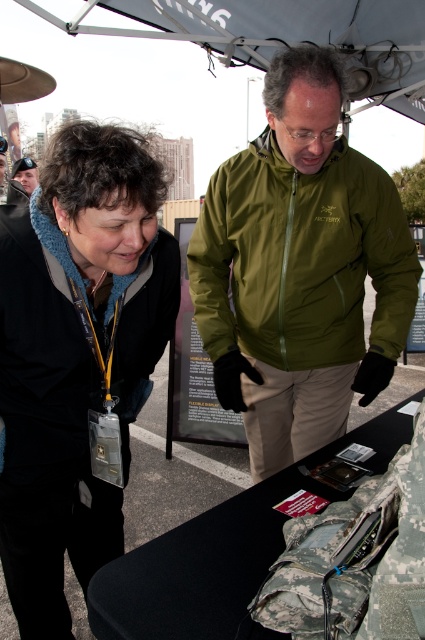
Is the position of black fleece jacket at upper left less distant than that of matte black helmet at upper left?

Yes, it is in front of matte black helmet at upper left.

Does black fleece jacket at upper left appear under matte black helmet at upper left?

Correct, black fleece jacket at upper left is located below matte black helmet at upper left.

Is point (127, 326) behind point (22, 180)?

That is False.

Where is `black fleece jacket at upper left`? black fleece jacket at upper left is located at coordinates (74, 356).

Does olive green jacket at center appear over matte black helmet at upper left?

Actually, olive green jacket at center is below matte black helmet at upper left.

Who is higher up, olive green jacket at center or matte black helmet at upper left?

matte black helmet at upper left is above.

Locate an element on the screen. The width and height of the screenshot is (425, 640). olive green jacket at center is located at coordinates (300, 268).

Does point (325, 225) lie behind point (116, 492)?

Yes, it is behind point (116, 492).

Can you confirm if olive green jacket at center is positioned to the right of black fleece jacket at upper left?

Indeed, olive green jacket at center is positioned on the right side of black fleece jacket at upper left.

Is point (302, 93) in front of point (65, 173)?

That is False.

I want to click on olive green jacket at center, so click(x=300, y=268).